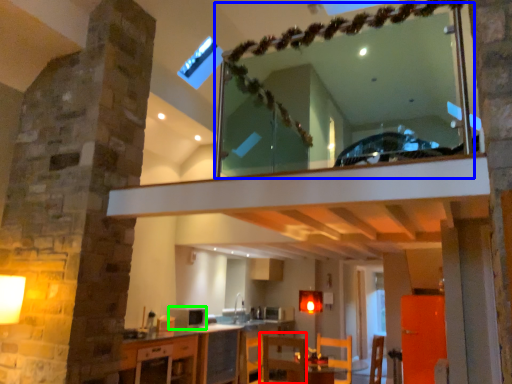
Question: Which object is the farthest from armchair (highlighted by a red box)? Choose among these: mirror (highlighted by a blue box) or appliance (highlighted by a green box).

Choices:
 (A) mirror
 (B) appliance

Answer: (A)